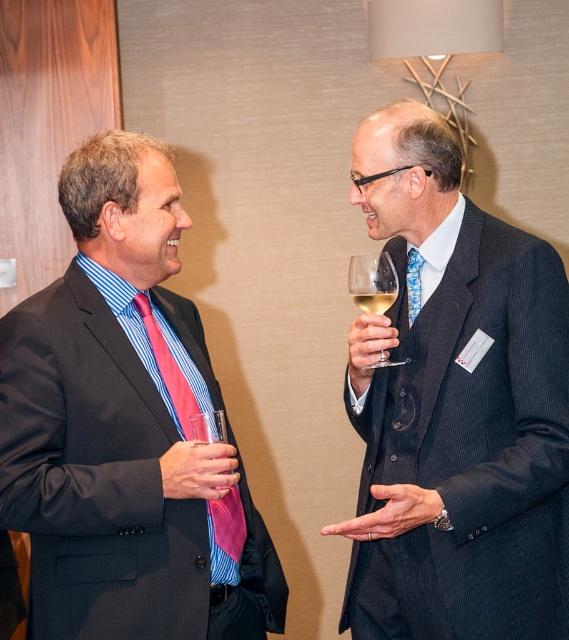
You are attending a formal event and need to locate the man in the dark pinstripe suit at right. Based on the scene, where would you find him relative to the clear glass wine glass at upper right?

The dark pinstripe suit at right is positioned under the clear glass wine glass at upper right, so you would find the man in the dark pinstripe suit at right located below the clear glass wine glass at upper right.

You are a photographer at a formal event. You need to capture a photo of the dark pinstripe suit at right and the clear glass wine at right. Which object should you focus on first if you want to include both in your frame?

The dark pinstripe suit at right is positioned on the right side of clear glass wine at right, so you should focus on the clear glass wine at right first to ensure both are in frame.

From the picture: You are a photographer at a formal event. You need to capture a photo that includes both the dark pinstripe suit at right and the clear glass wine glass at upper right. Since the camera can only focus on objects of similar height, will you need to adjust the framing to ensure both are in focus?

The dark pinstripe suit at right is taller than the clear glass wine glass at upper right. Since the camera requires objects to be of similar height for focus, you will need to adjust the framing to ensure both are in focus.